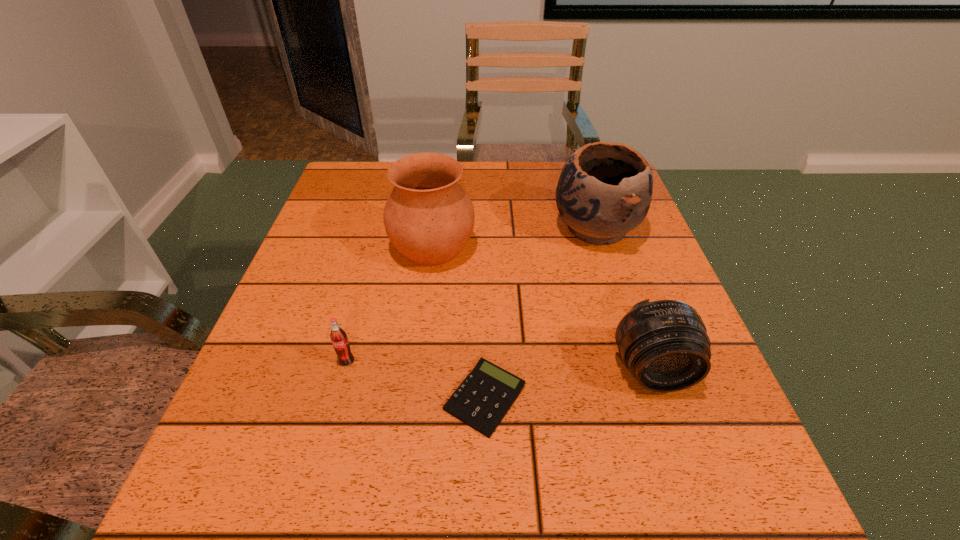
You are a GUI agent. You are given a task and a screenshot of the screen. Output one action in this format:
    pyautogui.click(x=<x>, y=<y>)
    Task: Click on the blank region between the right pottery and the third tallest object
    This screenshot has width=960, height=540.
    Given the screenshot: What is the action you would take?
    pyautogui.click(x=624, y=300)

I want to click on object that can be found as the third closest to the second shortest object, so click(x=664, y=344).

Choose which object is the fourth nearest neighbor to the calculator. Please provide its 2D coordinates. Your answer should be formatted as a tuple, i.e. [(x, y)], where the tuple contains the x and y coordinates of a point satisfying the conditions above.

[(604, 191)]

Identify the location of free region that satisfies the following two spatial constraints: 1. on the label of the shortest object; 2. on the right side of the soda bottle. click(337, 398).

What are the coordinates of `vacant region that satisfies the following two spatial constraints: 1. on the label of the fourth tallest object; 2. on the right side of the calculator` in the screenshot? It's located at click(337, 398).

Locate an element on the screen. vacant space that satisfies the following two spatial constraints: 1. on the front side of the left pottery; 2. on the left side of the shortest object is located at coordinates (414, 398).